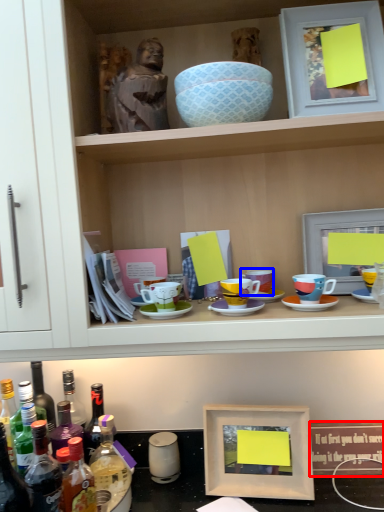
Question: Which object is further to the camera taking this photo, picture frame (highlighted by a red box) or coffee cup (highlighted by a blue box)?

Choices:
 (A) picture frame
 (B) coffee cup

Answer: (A)